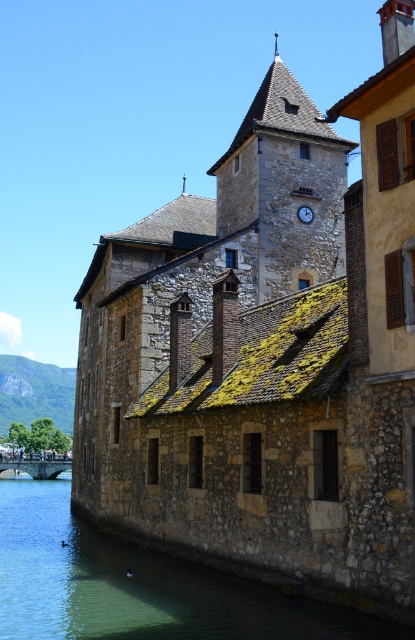
Who is lower down, clear water at river lower left or stone clock tower at center?

clear water at river lower left

This screenshot has width=415, height=640. Find the location of `clear water at river lower left`. clear water at river lower left is located at coordinates (139, 586).

This screenshot has width=415, height=640. I want to click on clear water at river lower left, so click(x=139, y=586).

Which is more to the left, clear water at river lower left or black metallic clock at upper center?

clear water at river lower left is more to the left.

Does clear water at river lower left have a lesser width compared to black metallic clock at upper center?

No, clear water at river lower left is not thinner than black metallic clock at upper center.

Is point (78, 576) closer to viewer compared to point (300, 205)?

Yes, point (78, 576) is in front of point (300, 205).

Where is `clear water at river lower left`? Image resolution: width=415 pixels, height=640 pixels. clear water at river lower left is located at coordinates (139, 586).

From the picture: Which is above, stone clock tower at center or black metallic clock at upper center?

stone clock tower at center is higher up.

Image resolution: width=415 pixels, height=640 pixels. What do you see at coordinates (285, 184) in the screenshot?
I see `stone clock tower at center` at bounding box center [285, 184].

Which is in front, point (302, 285) or point (307, 218)?

Point (302, 285)

Locate an element on the screen. stone clock tower at center is located at coordinates (285, 184).